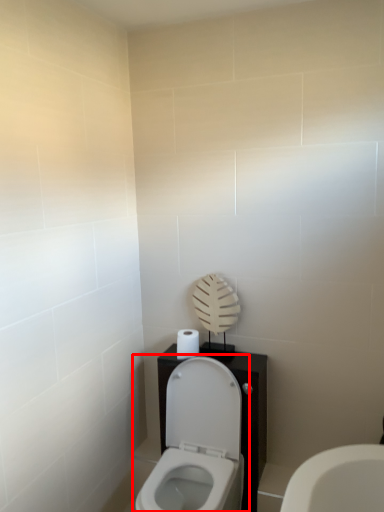
Question: Considering the relative positions of toilet (annotated by the red box) and toilet paper in the image provided, where is toilet (annotated by the red box) located with respect to the staircase?

Choices:
 (A) right
 (B) left

Answer: (A)